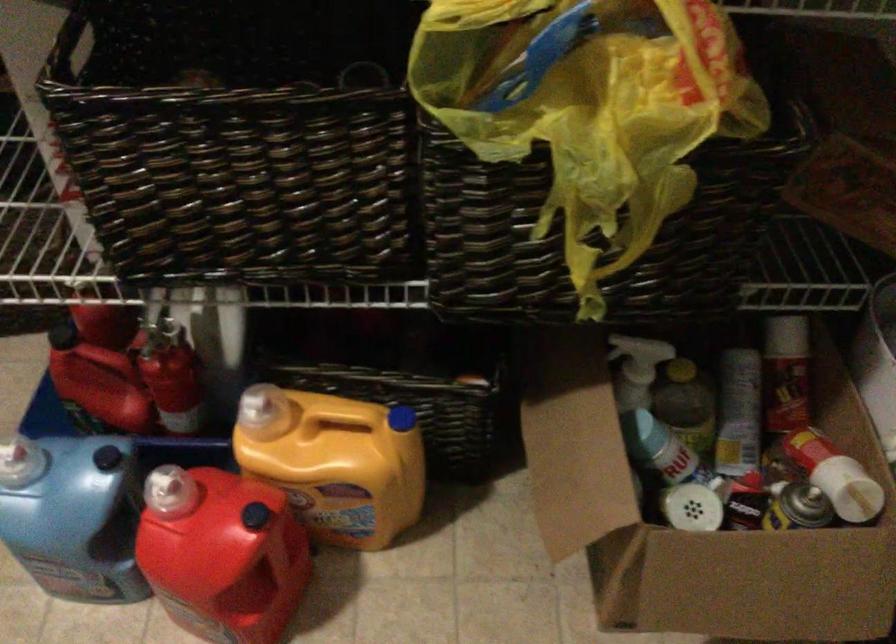
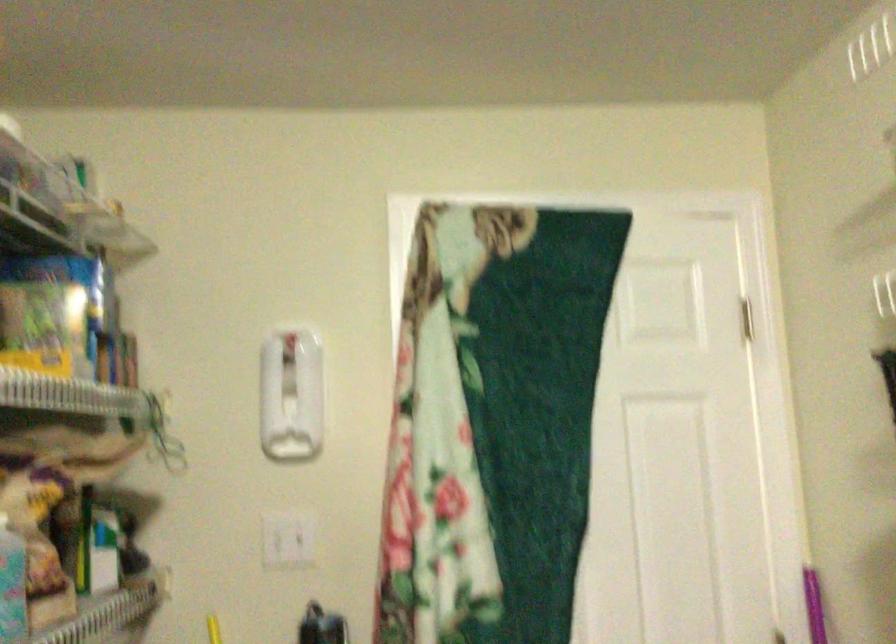
Question: The images are taken continuously from a first-person perspective. In which direction is your viewpoint rotating?

Choices:
 (A) Left
 (B) Right
 (C) Up
 (D) Down

Answer: (B)